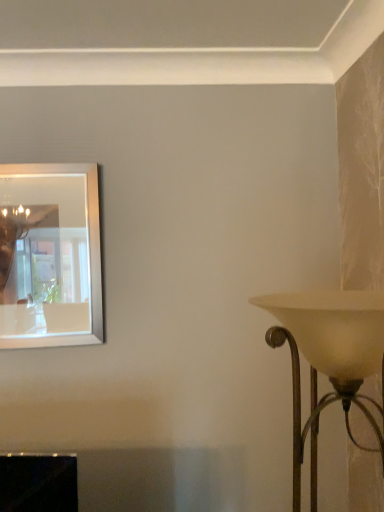
Describe the element at coordinates (44, 255) in the screenshot. This screenshot has height=512, width=384. I see `silver/metallic mirror at upper left` at that location.

Image resolution: width=384 pixels, height=512 pixels. Identify the location of silver/metallic mirror at upper left. (44, 255).

You are a GUI agent. You are given a task and a screenshot of the screen. Output one action in this format:
    pyautogui.click(x=<x>, y=<y>)
    Task: Click on the silver/metallic mirror at upper left
    Image resolution: width=384 pixels, height=512 pixels.
    Given the screenshot: What is the action you would take?
    pyautogui.click(x=44, y=255)